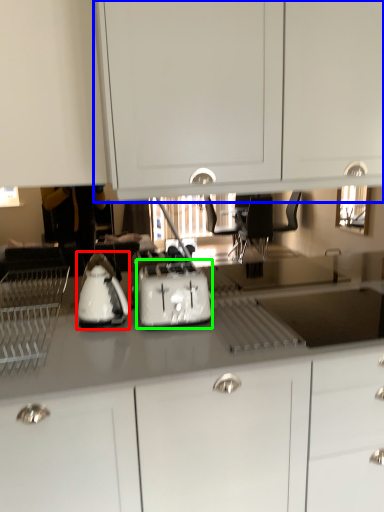
Question: Considering the real-world distances, which object is farthest from kitchen appliance (highlighted by a red box)? cabinetry (highlighted by a blue box) or toaster (highlighted by a green box)?

Choices:
 (A) cabinetry
 (B) toaster

Answer: (A)